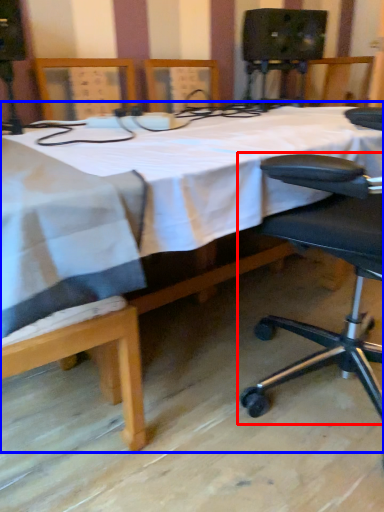
Question: Which object is closer to the camera taking this photo, chair (highlighted by a red box) or table (highlighted by a blue box)?

Choices:
 (A) chair
 (B) table

Answer: (B)